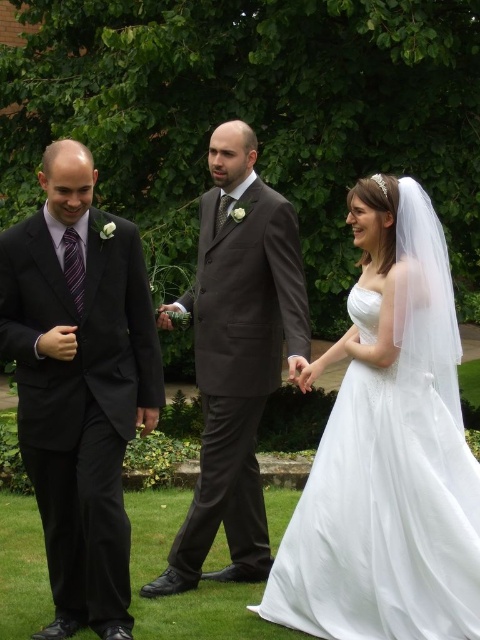
Is black satin suit at left further to camera compared to dark gray suit at center?

No, it is in front of dark gray suit at center.

In the scene shown: Is black satin suit at left taller than dark gray suit at center?

No, black satin suit at left is not taller than dark gray suit at center.

The image size is (480, 640). Describe the element at coordinates (80, 384) in the screenshot. I see `black satin suit at left` at that location.

Where is `black satin suit at left`? This screenshot has height=640, width=480. black satin suit at left is located at coordinates (80, 384).

Between black satin suit at left and green grass at lower center, which one appears on the left side from the viewer's perspective?

Positioned to the left is black satin suit at left.

Which is behind, point (156, 388) or point (133, 499)?

Positioned behind is point (133, 499).

Where is `black satin suit at left`? The width and height of the screenshot is (480, 640). black satin suit at left is located at coordinates (80, 384).

Who is shorter, white satin dress at center or green grass at lower center?

green grass at lower center

Looking at this image, does white satin dress at center appear under green grass at lower center?

No.

Is point (312, 605) farther from viewer compared to point (222, 602)?

No.

Locate an element on the screen. This screenshot has height=640, width=480. white satin dress at center is located at coordinates (387, 506).